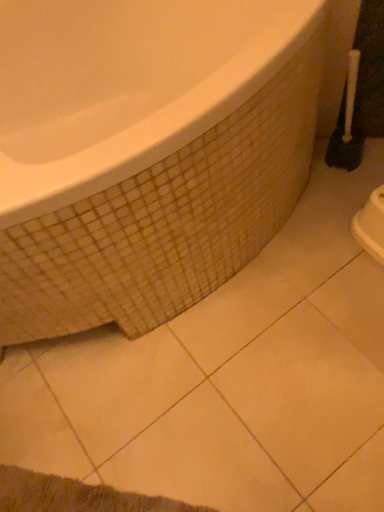
Describe the element at coordinates (347, 125) in the screenshot. The height and width of the screenshot is (512, 384). I see `white plastic toilet brush at right` at that location.

You are a GUI agent. You are given a task and a screenshot of the screen. Output one action in this format:
    pyautogui.click(x=<x>, y=<y>)
    Task: Click on the white plastic toilet brush at right
    
    Given the screenshot: What is the action you would take?
    pyautogui.click(x=347, y=125)

Locate an element on the screen. The height and width of the screenshot is (512, 384). white glossy bathtub at upper left is located at coordinates (146, 152).

Measure the distance between point (67, 267) and camera.

Point (67, 267) is 31.38 inches from camera.

Describe the element at coordinates (146, 152) in the screenshot. This screenshot has width=384, height=512. I see `white glossy bathtub at upper left` at that location.

What is the approximate width of white glossy bathtub at upper left?

white glossy bathtub at upper left is 3.49 feet wide.

This screenshot has width=384, height=512. Find the location of `white plastic toilet brush at right`. white plastic toilet brush at right is located at coordinates (347, 125).

In the image, is white plastic toilet brush at right on the left side or the right side of white glossy bathtub at upper left?

white plastic toilet brush at right is to the right of white glossy bathtub at upper left.

Who is more distant, white plastic toilet brush at right or white glossy bathtub at upper left?

white plastic toilet brush at right is further from the camera.

Is point (343, 138) closer to camera compared to point (27, 166)?

No.

From the image's perspective, is white plastic toilet brush at right on top of white glossy bathtub at upper left?

Yes.

From a real-world perspective, is white plastic toilet brush at right on top of white glossy bathtub at upper left?

No, from a real-world perspective, white plastic toilet brush at right is not on top of white glossy bathtub at upper left.

Does white plastic toilet brush at right have a greater width compared to white glossy bathtub at upper left?

In fact, white plastic toilet brush at right might be narrower than white glossy bathtub at upper left.

Considering the relative sizes of white plastic toilet brush at right and white glossy bathtub at upper left in the image provided, is white plastic toilet brush at right taller than white glossy bathtub at upper left?

No.

Is white plastic toilet brush at right bigger than white glossy bathtub at upper left?

No.

Do you think white plastic toilet brush at right is within white glossy bathtub at upper left, or outside of it?

white plastic toilet brush at right is not inside white glossy bathtub at upper left, it's outside.

Are white plastic toilet brush at right and white glossy bathtub at upper left located far from each other?

No, there isn't a large distance between white plastic toilet brush at right and white glossy bathtub at upper left.

Is white plastic toilet brush at right facing towards white glossy bathtub at upper left?

Yes, white plastic toilet brush at right faces towards white glossy bathtub at upper left.

The height and width of the screenshot is (512, 384). Identify the location of bathtub in front of the white plastic toilet brush at right. (146, 152).

In the image, is white glossy bathtub at upper left on the left side or the right side of white plastic toilet brush at right?

Based on their positions, white glossy bathtub at upper left is located to the left of white plastic toilet brush at right.

Considering the relative positions of white glossy bathtub at upper left and white plastic toilet brush at right in the image provided, is white glossy bathtub at upper left in front of white plastic toilet brush at right?

Yes, white glossy bathtub at upper left is in front of white plastic toilet brush at right.

Does point (119, 202) come behind point (333, 142)?

No, (119, 202) is in front of (333, 142).

From the image's perspective, is white glossy bathtub at upper left beneath white plastic toilet brush at right?

Correct, white glossy bathtub at upper left appears lower than white plastic toilet brush at right in the image.

Consider the image. From a real-world perspective, between white glossy bathtub at upper left and white plastic toilet brush at right, who is vertically higher?

white glossy bathtub at upper left is physically above.

Between white glossy bathtub at upper left and white plastic toilet brush at right, which one has larger width?

With larger width is white glossy bathtub at upper left.

Considering the sizes of white glossy bathtub at upper left and white plastic toilet brush at right in the image, is white glossy bathtub at upper left taller or shorter than white plastic toilet brush at right?

Clearly, white glossy bathtub at upper left is taller compared to white plastic toilet brush at right.

Based on their sizes in the image, would you say white glossy bathtub at upper left is bigger or smaller than white plastic toilet brush at right?

white glossy bathtub at upper left is bigger than white plastic toilet brush at right.

Would you say white glossy bathtub at upper left is outside white plastic toilet brush at right?

Yes, white glossy bathtub at upper left is located beyond the bounds of white plastic toilet brush at right.

Is white glossy bathtub at upper left placed right next to white plastic toilet brush at right?

No, white glossy bathtub at upper left is not in contact with white plastic toilet brush at right.

Is white glossy bathtub at upper left turned away from white plastic toilet brush at right?

No, white glossy bathtub at upper left is not facing the opposite direction of white plastic toilet brush at right.

What's the angular difference between white glossy bathtub at upper left and white plastic toilet brush at right's facing directions?

4.14 degrees separate the facing orientations of white glossy bathtub at upper left and white plastic toilet brush at right.

Locate an element on the screen. This screenshot has height=512, width=384. bathtub above the white plastic toilet brush at right (from a real-world perspective) is located at coordinates (146, 152).

You are a GUI agent. You are given a task and a screenshot of the screen. Output one action in this format:
    pyautogui.click(x=<x>, y=<y>)
    Task: Click on the bathtub on the left of white plastic toilet brush at right
    The height and width of the screenshot is (512, 384).
    Given the screenshot: What is the action you would take?
    pyautogui.click(x=146, y=152)

Identify the location of brush on the right of white glossy bathtub at upper left. This screenshot has width=384, height=512. (347, 125).